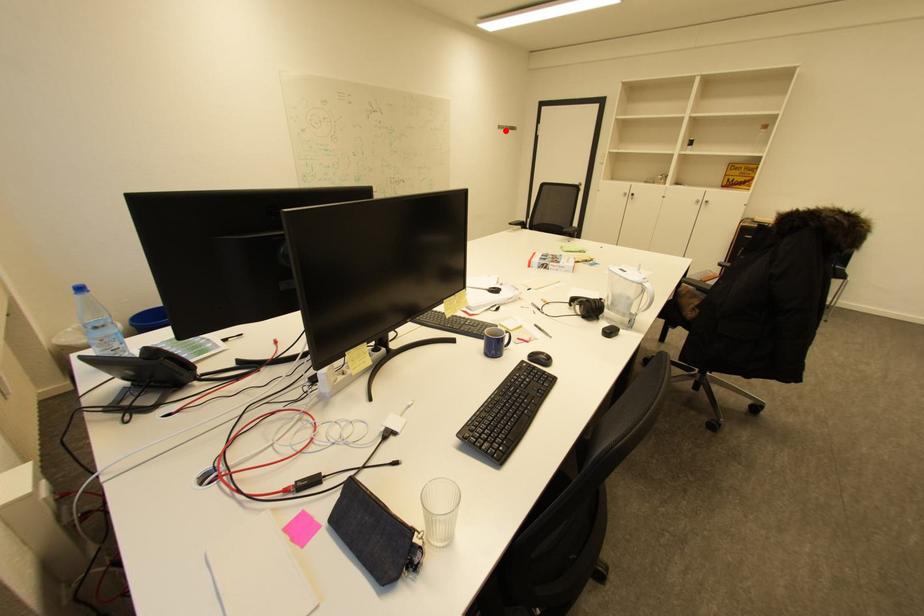
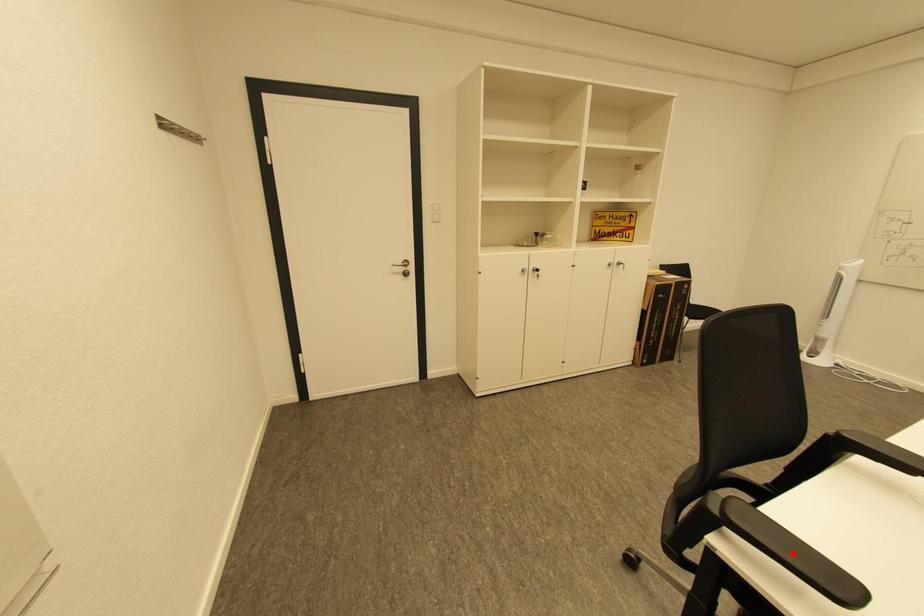
I am providing you with two images of the same scene from different viewpoints. A red point is marked on the first image and another point is marked on the second image. Do the highlighted points in image1 and image2 indicate the same real-world spot?

No